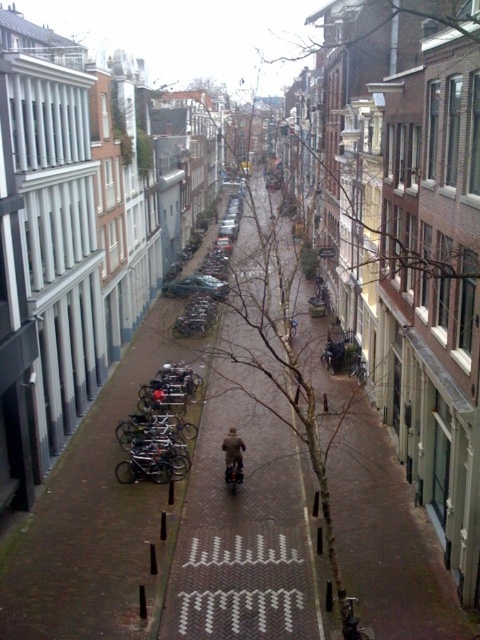
You are a tourist standing on the narrow urban street and want to take a photo that includes both point (180, 611) and point (140, 449). Since you want to ensure both points are in focus, which point should you focus on to maximize the depth of field?

You should focus on point (140, 449) because it is farther away from the viewer than point (180, 611). Focusing on the farther point will help ensure both points are within the depth of field.

You are standing at the point closest to the camera in the image. There are two points marked in the scene, one at coordinate point (x=264, y=193) and another at point (x=231, y=452). Which point should you walk towards to reach the point further away from your current position?

You should walk towards point (x=264, y=193) because it is behind point (x=231, y=452), meaning it is farther away from your current position.